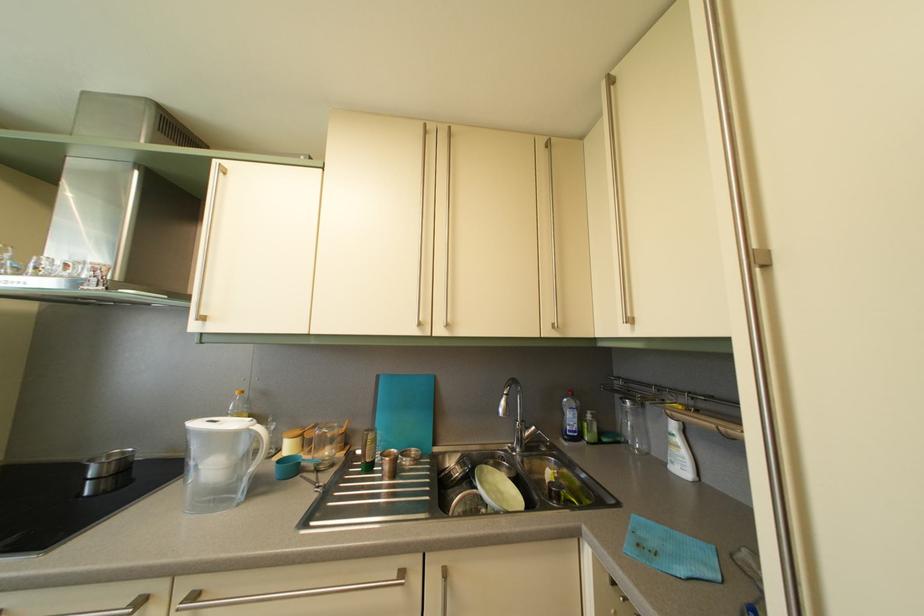
The location [687,509] corresponds to which object?

It refers to a green bowl.